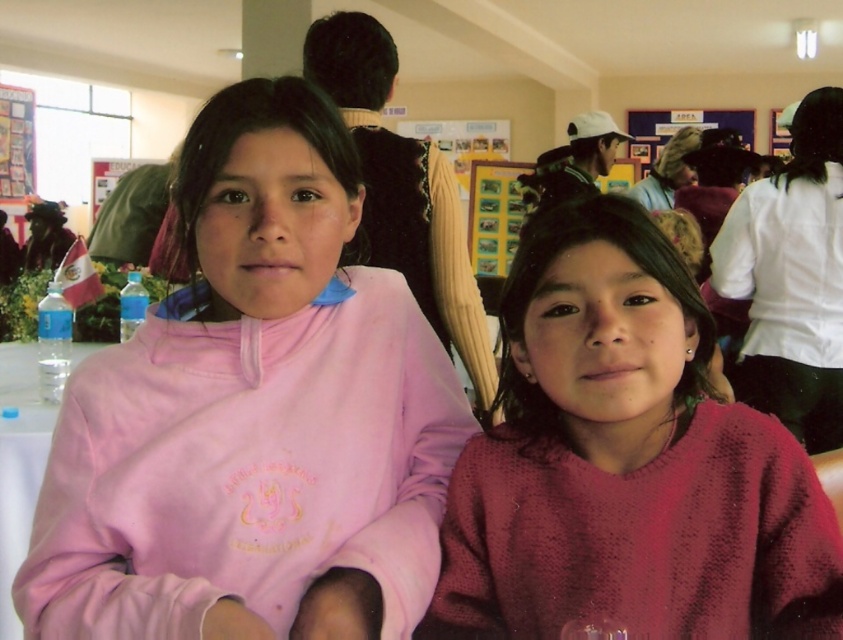
Question: Which point appears closest to the camera in this image?

Choices:
 (A) (247, 419)
 (B) (578, 362)

Answer: (B)

Question: Which of the following is the farthest from the observer?

Choices:
 (A) (286, 276)
 (B) (605, 228)

Answer: (B)

Question: Can you confirm if pink fleece jacket at center is positioned to the right of knitted maroon sweater at center?

Choices:
 (A) yes
 (B) no

Answer: (B)

Question: Does pink fleece jacket at center appear over knitted maroon sweater at center?

Choices:
 (A) yes
 (B) no

Answer: (A)

Question: Can you confirm if pink fleece jacket at center is positioned to the left of knitted maroon sweater at center?

Choices:
 (A) yes
 (B) no

Answer: (A)